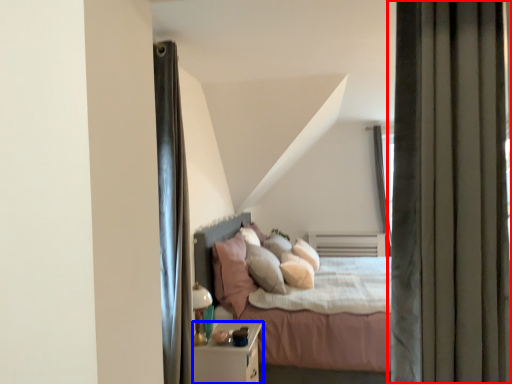
Question: Which object is further to the camera taking this photo, curtain (highlighted by a red box) or nightstand (highlighted by a blue box)?

Choices:
 (A) curtain
 (B) nightstand

Answer: (B)